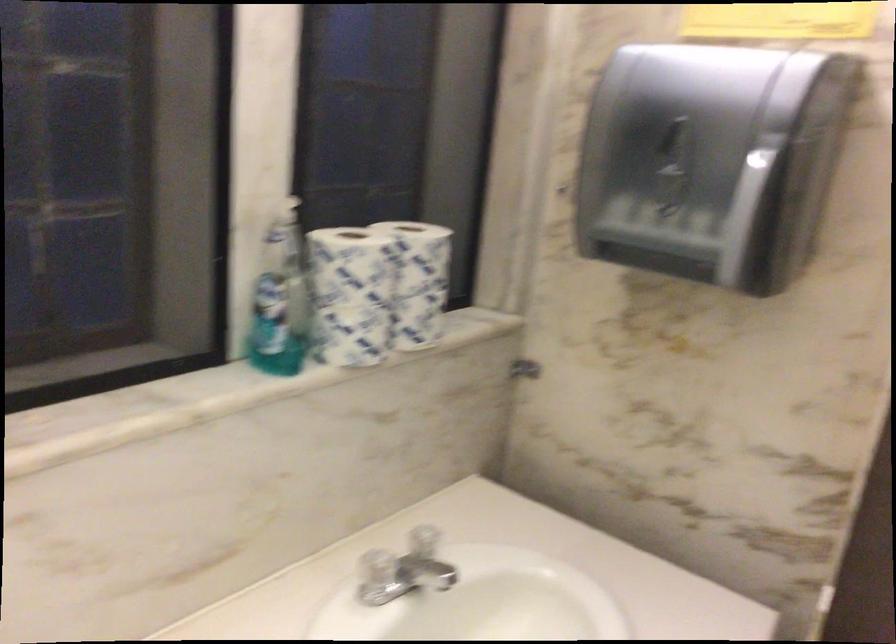
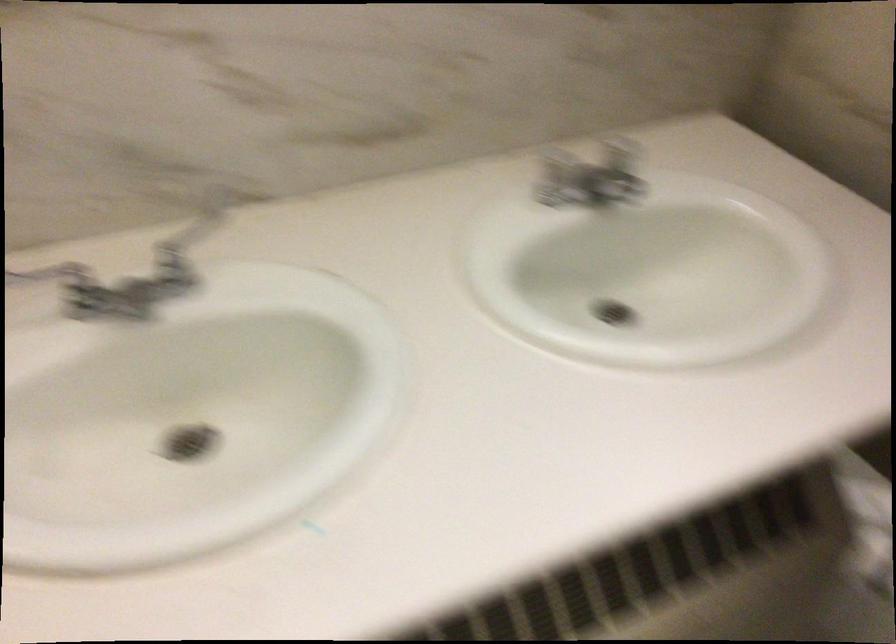
Locate, in the second image, the point that corresponds to pixel 385 560 in the first image.

(554, 158)